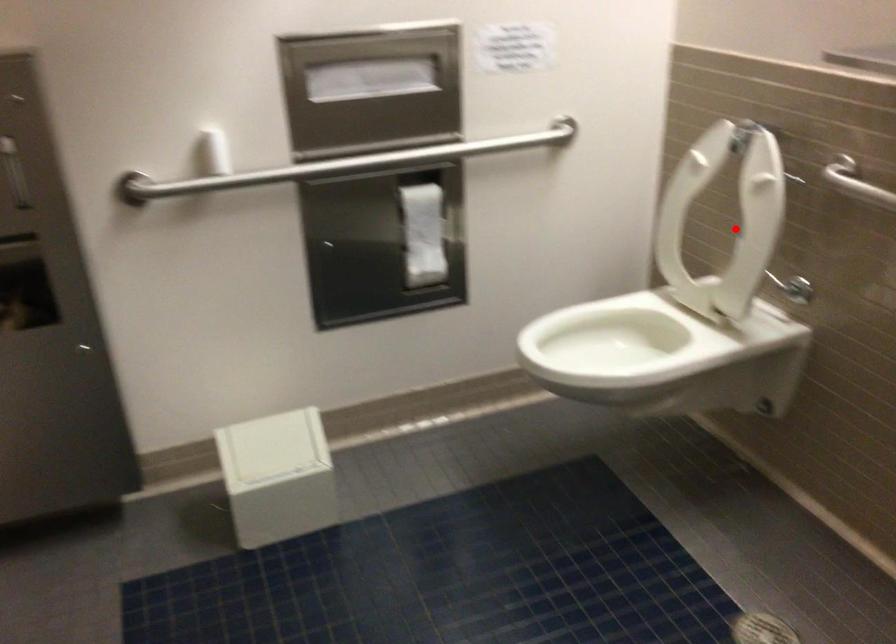
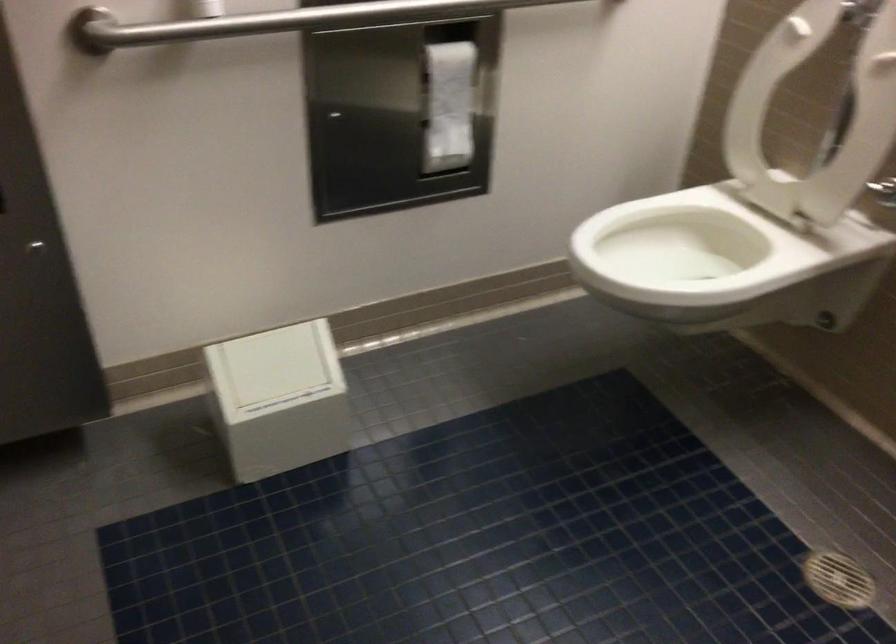
Question: I am providing you with two images of the same scene from different viewpoints. A red point is shown in image1. For the corresponding object point in image2, is it positioned nearer or farther from the camera?

Choices:
 (A) Nearer
 (B) Farther

Answer: (A)